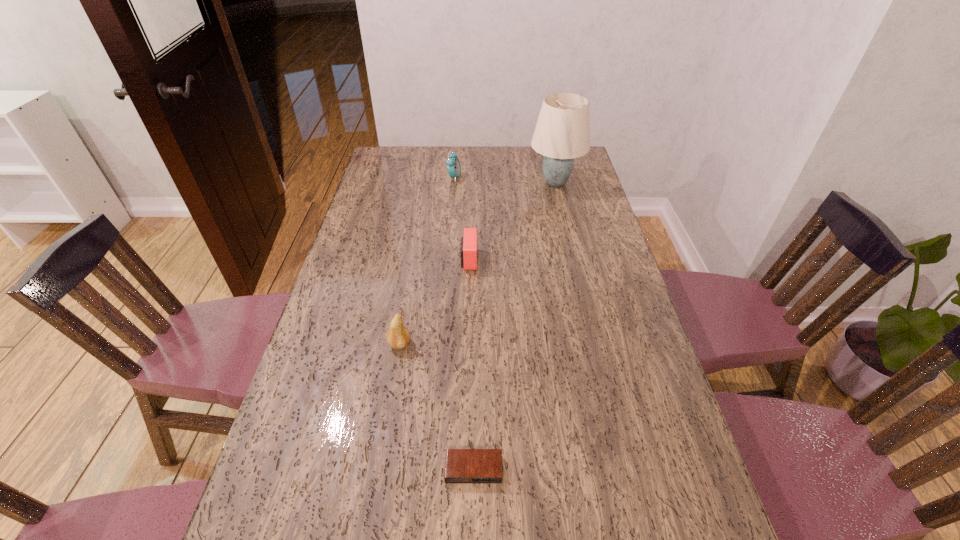
Locate an element on the screen. This screenshot has width=960, height=540. the tallest object is located at coordinates (562, 133).

At what (x,y) coordinates should I click in order to perform the action: click on the rightmost object. Please return your answer as a coordinate pair (x, y). This screenshot has height=540, width=960. Looking at the image, I should click on click(x=562, y=133).

This screenshot has width=960, height=540. Identify the location of the leftmost alarm clock. (453, 165).

The width and height of the screenshot is (960, 540). In order to click on the farthest alarm clock in this screenshot , I will do `click(453, 165)`.

Locate an element on the screen. The width and height of the screenshot is (960, 540). the leftmost object is located at coordinates (398, 336).

At what (x,y) coordinates should I click in order to perform the action: click on the fourth farthest object. Please return your answer as a coordinate pair (x, y). Image resolution: width=960 pixels, height=540 pixels. Looking at the image, I should click on (398, 336).

Identify the location of the second nearest alarm clock. (468, 242).

At what (x,y) coordinates should I click in order to perform the action: click on the second shortest object. Please return your answer as a coordinate pair (x, y). Image resolution: width=960 pixels, height=540 pixels. Looking at the image, I should click on (468, 242).

Identify the location of the shortest object. This screenshot has width=960, height=540. (462, 466).

The image size is (960, 540). I want to click on the shortest alarm clock, so click(x=462, y=466).